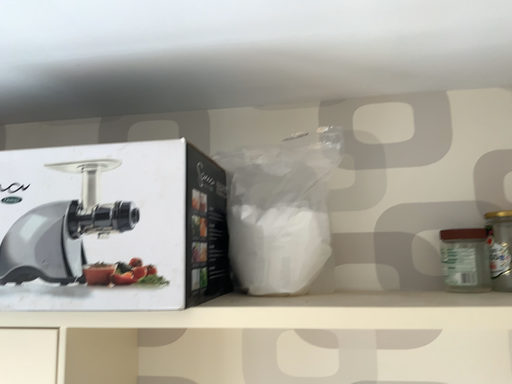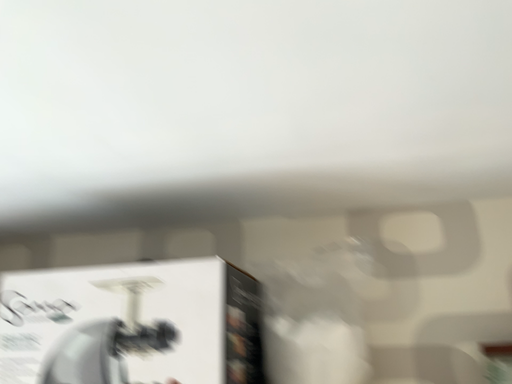
Question: Which way did the camera rotate in the video?

Choices:
 (A) rotated upward
 (B) rotated downward

Answer: (A)